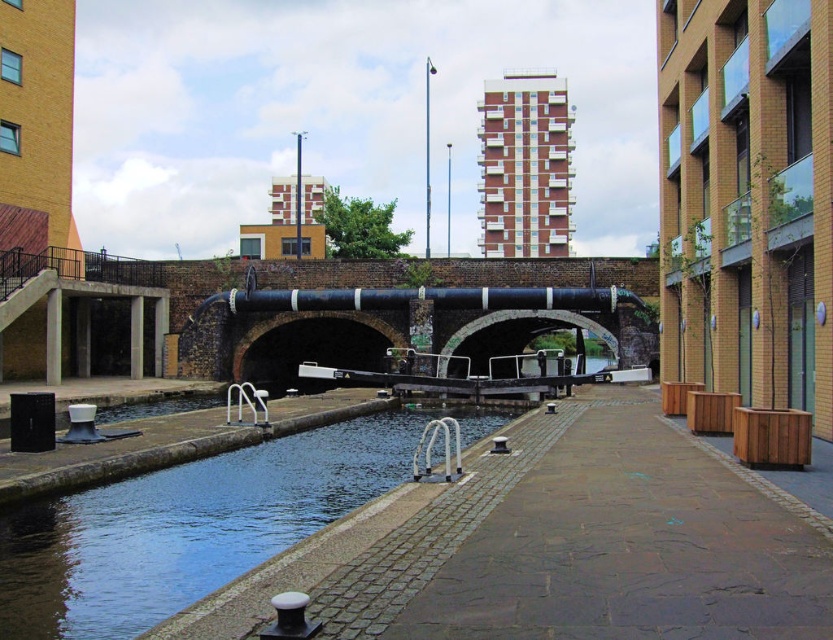
The image size is (833, 640). What are the coordinates of `smooth concrete river at center` in the screenshot? It's located at (193, 524).

Does smooth concrete river at center have a larger size compared to black concrete bridge at center?

No, smooth concrete river at center is not bigger than black concrete bridge at center.

Does point (387, 442) come closer to viewer compared to point (584, 304)?

Yes.

Identify the location of smooth concrete river at center. (193, 524).

Can you confirm if brown stone path at center is positioned to the right of black concrete bridge at center?

Correct, you'll find brown stone path at center to the right of black concrete bridge at center.

Does brown stone path at center have a greater width compared to black concrete bridge at center?

In fact, brown stone path at center might be narrower than black concrete bridge at center.

Does point (599, 632) come farther from viewer compared to point (460, 289)?

That is False.

Find the location of a particular element. The height and width of the screenshot is (640, 833). brown stone path at center is located at coordinates (631, 547).

Does brown stone path at center have a greater height compared to smooth concrete river at center?

No, brown stone path at center is not taller than smooth concrete river at center.

Is point (829, 620) less distant than point (153, 547)?

Yes, it is in front of point (153, 547).

Is point (826, 573) behind point (230, 548)?

No, it is in front of (230, 548).

Locate an element on the screen. brown stone path at center is located at coordinates (631, 547).